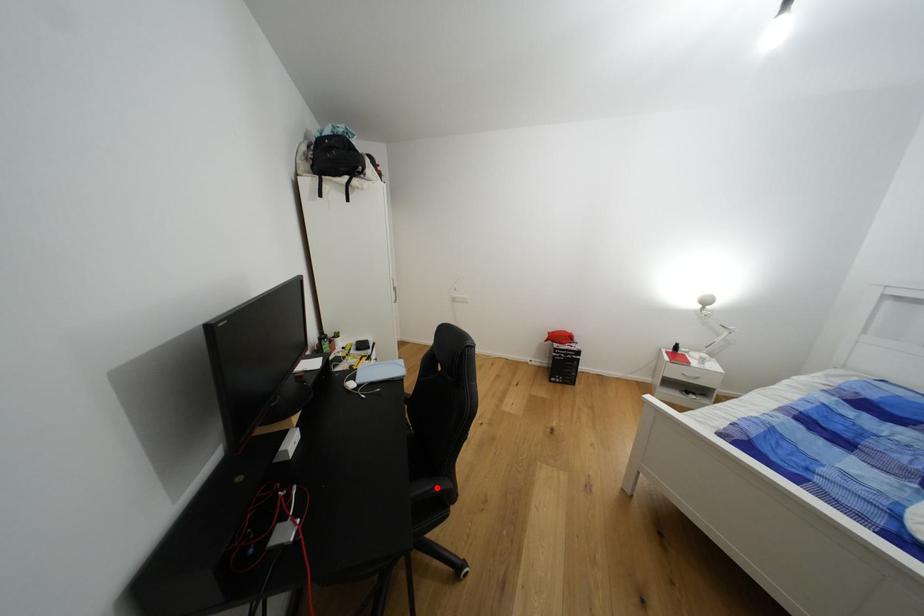
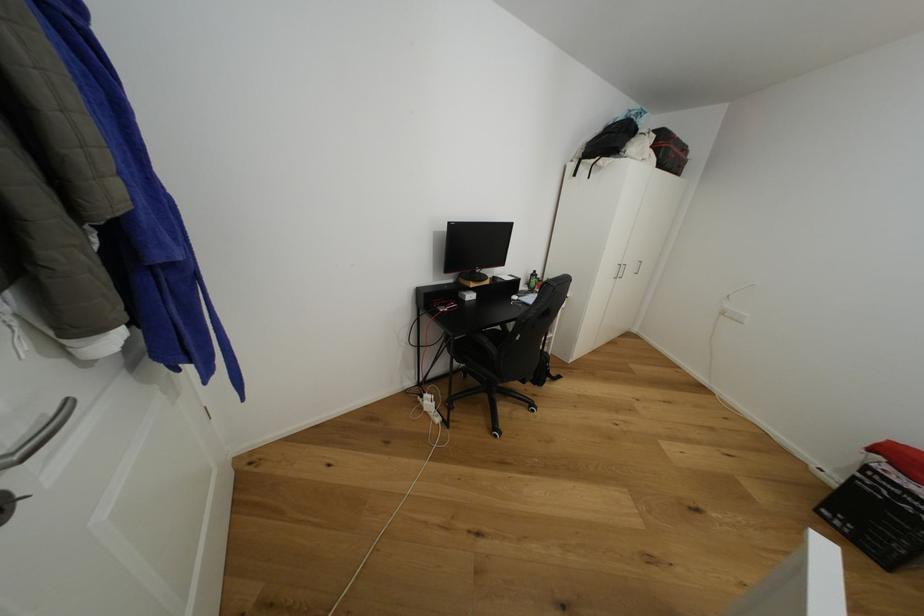
Question: I am providing you with two images of the same scene from different viewpoints. A red point is shown in image1. For the corresponding object point in image2, is it positioned nearer or farther from the camera?

Choices:
 (A) Nearer
 (B) Farther

Answer: (B)